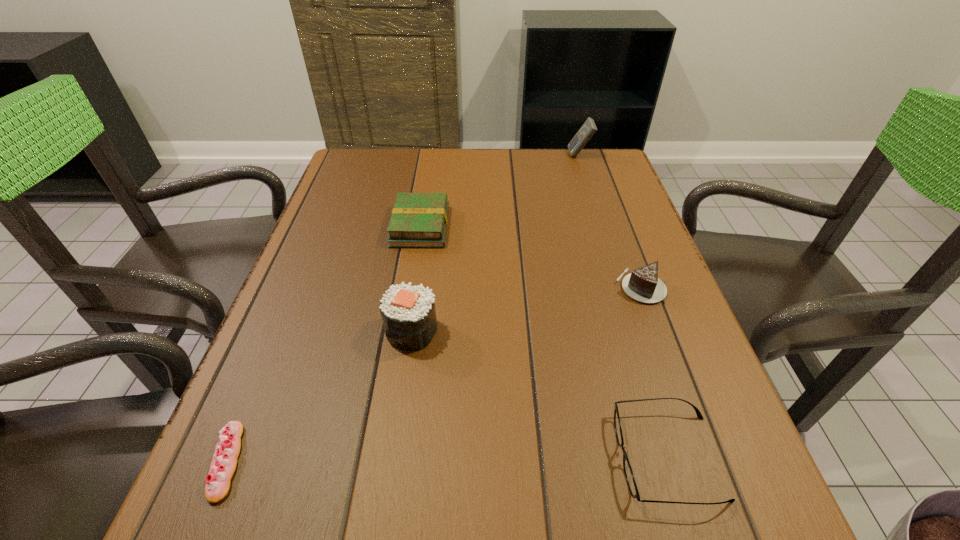
I want to click on object that is at the far edge, so click(x=588, y=129).

Locate an element on the screen. spectacles at the near edge is located at coordinates (628, 472).

Identify the location of eclair at the near edge. 223,465.

Image resolution: width=960 pixels, height=540 pixels. I want to click on object that is at the left edge, so click(223, 465).

The height and width of the screenshot is (540, 960). I want to click on calculator that is at the right edge, so point(588,129).

Identify the location of chocolate cake that is at the right edge. This screenshot has width=960, height=540. (643, 285).

Where is `spectacles at the right edge`? Image resolution: width=960 pixels, height=540 pixels. spectacles at the right edge is located at coordinates (628, 472).

Where is `object at the near left corner`? object at the near left corner is located at coordinates (223, 465).

I want to click on object located at the far right corner, so click(x=588, y=129).

What are the coordinates of `object that is positioned at the near right corner` in the screenshot? It's located at tap(628, 472).